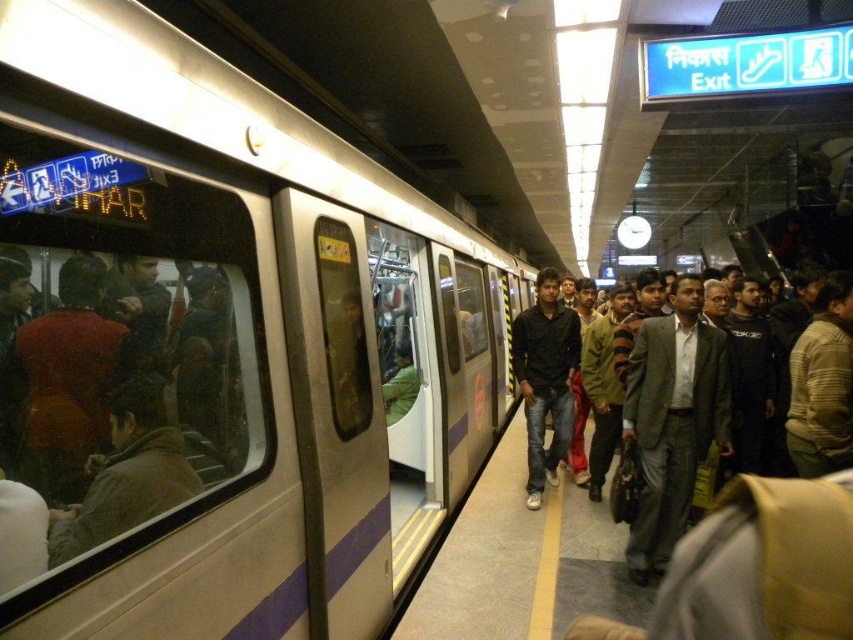
Is silver metallic train at center bigger than black matte shirt at center?

Correct, silver metallic train at center is larger in size than black matte shirt at center.

Is silver metallic train at center positioned in front of black matte shirt at center?

Yes, silver metallic train at center is in front of black matte shirt at center.

Describe the element at coordinates (224, 344) in the screenshot. I see `silver metallic train at center` at that location.

Where is `silver metallic train at center`? The width and height of the screenshot is (853, 640). silver metallic train at center is located at coordinates (224, 344).

Does gray suit at center appear on the right side of brown leather jacket at left?

Indeed, gray suit at center is positioned on the right side of brown leather jacket at left.

Is point (680, 300) positioned before point (56, 528)?

That is False.

At what (x,y) coordinates should I click in order to perform the action: click on gray suit at center. Please return your answer as a coordinate pair (x, y). The height and width of the screenshot is (640, 853). Looking at the image, I should click on coord(672,419).

Which is more to the left, gray suit at center or dark gray suit at center?

Positioned to the left is gray suit at center.

I want to click on gray suit at center, so click(x=672, y=419).